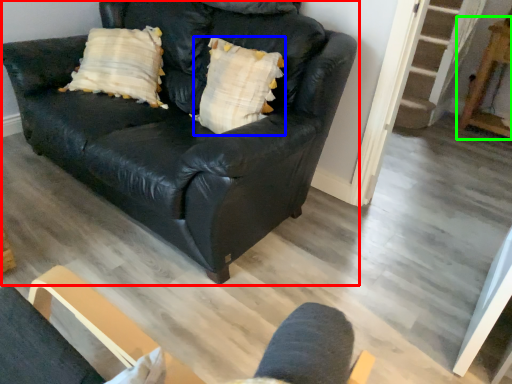
Question: Which is nearer to the studio couch (highlighted by a red box)? pillow (highlighted by a blue box) or table (highlighted by a green box).

Choices:
 (A) pillow
 (B) table

Answer: (A)